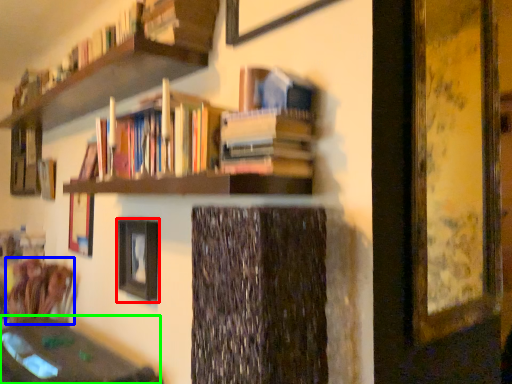
Question: Based on their relative distances, which object is farther from picture frame (highlighted by a red box)? Choose from swivel chair (highlighted by a blue box) and round table (highlighted by a green box).

Choices:
 (A) swivel chair
 (B) round table

Answer: (A)